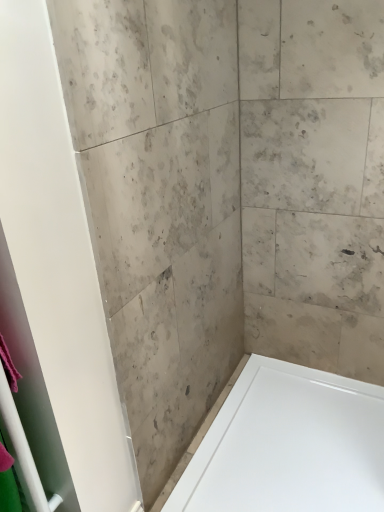
Question: Does pink fabric at left have a larger size compared to white glossy bathtub at lower right?

Choices:
 (A) no
 (B) yes

Answer: (A)

Question: Does pink fabric at left appear on the left side of white glossy bathtub at lower right?

Choices:
 (A) yes
 (B) no

Answer: (A)

Question: From the image's perspective, would you say pink fabric at left is positioned over white glossy bathtub at lower right?

Choices:
 (A) yes
 (B) no

Answer: (A)

Question: Can you confirm if pink fabric at left is thinner than white glossy bathtub at lower right?

Choices:
 (A) yes
 (B) no

Answer: (A)

Question: Is pink fabric at left positioned beyond the bounds of white glossy bathtub at lower right?

Choices:
 (A) yes
 (B) no

Answer: (A)

Question: Can you confirm if pink fabric at left is positioned to the right of white glossy bathtub at lower right?

Choices:
 (A) no
 (B) yes

Answer: (A)

Question: From the image's perspective, would you say white glossy bathtub at lower right is positioned over pink fabric at left?

Choices:
 (A) yes
 (B) no

Answer: (B)

Question: From a real-world perspective, is white glossy bathtub at lower right on pink fabric at left?

Choices:
 (A) yes
 (B) no

Answer: (B)

Question: Would you say pink fabric at left is part of white glossy bathtub at lower right's contents?

Choices:
 (A) no
 (B) yes

Answer: (A)

Question: Is white glossy bathtub at lower right to the left of pink fabric at left from the viewer's perspective?

Choices:
 (A) yes
 (B) no

Answer: (B)

Question: Does white glossy bathtub at lower right have a larger size compared to pink fabric at left?

Choices:
 (A) no
 (B) yes

Answer: (B)

Question: Is white glossy bathtub at lower right thinner than pink fabric at left?

Choices:
 (A) yes
 (B) no

Answer: (B)

Question: Does point (57, 467) appear closer or farther from the camera than point (256, 362)?

Choices:
 (A) farther
 (B) closer

Answer: (B)